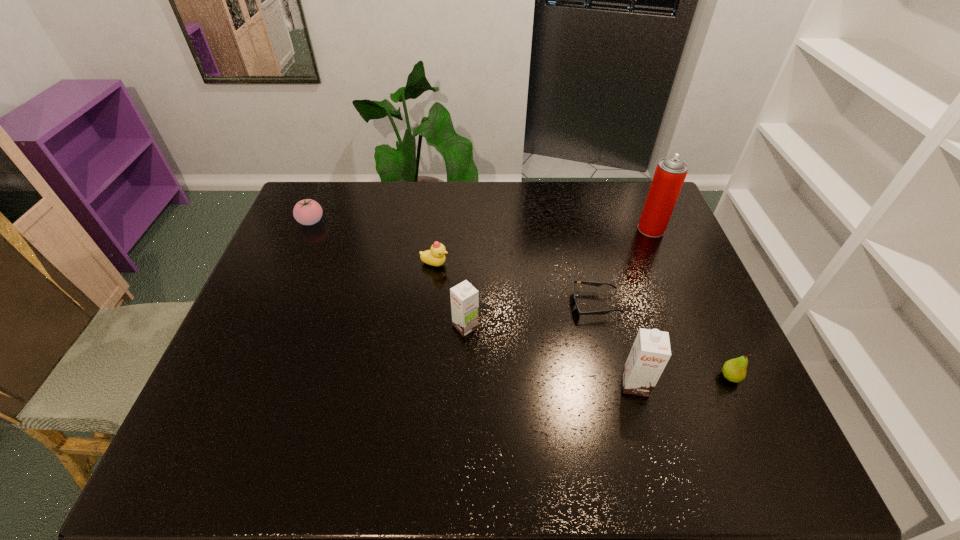
Identify the location of vacant space located on the front of the farther chocolate milk. (464, 397).

I want to click on free space located 0.330m on the back of the sixth shortest object, so click(605, 274).

Find the location of a particular element. The height and width of the screenshot is (540, 960). blank space located 0.080m on the front of the tomato is located at coordinates click(300, 247).

In order to click on free space located on the front-facing side of the third farthest object in this screenshot , I will do `click(542, 264)`.

Locate an element on the screen. vacant region located 0.120m on the front-facing side of the sunglasses is located at coordinates (528, 305).

Where is `vacant area situated on the front-facing side of the sunglasses`? This screenshot has width=960, height=540. vacant area situated on the front-facing side of the sunglasses is located at coordinates pos(540,305).

This screenshot has height=540, width=960. Find the location of `free region located 0.110m on the front-facing side of the sunglasses`. free region located 0.110m on the front-facing side of the sunglasses is located at coordinates (532, 305).

This screenshot has width=960, height=540. Identify the location of vacant space located on the front of the tallest object. (679, 294).

Where is `vacant position located on the back of the pear`? vacant position located on the back of the pear is located at coordinates (700, 310).

Identify the location of tomato positioned at the far edge. (307, 212).